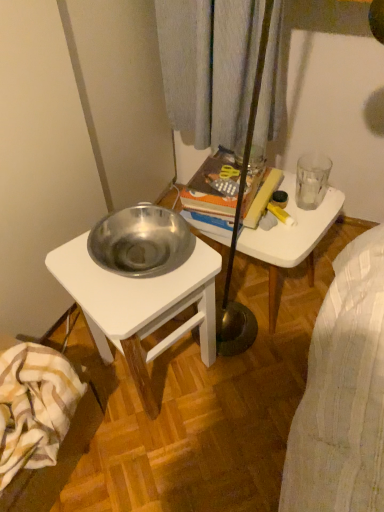
I want to click on vacant space underneath white glossy table at upper center (from a real-world perspective), so pos(287,301).